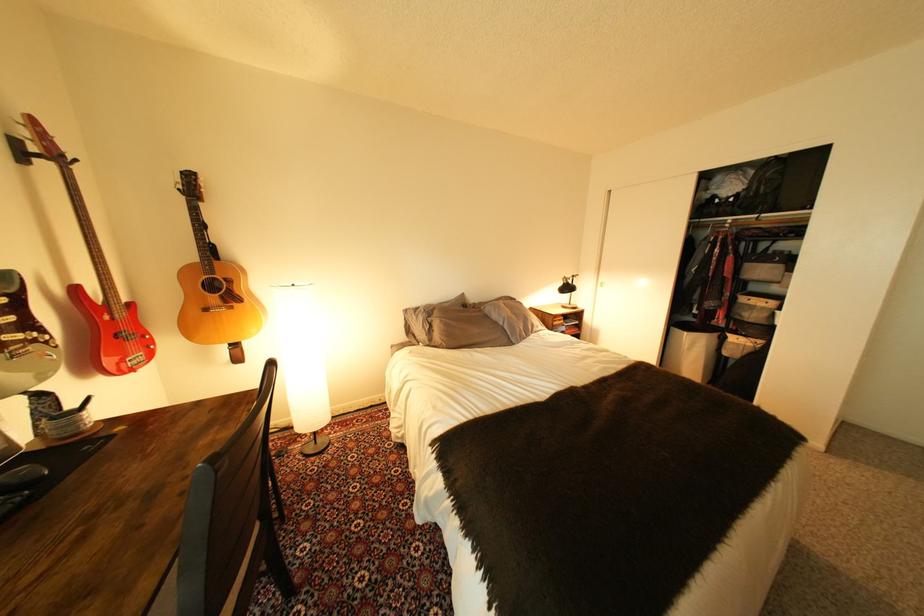
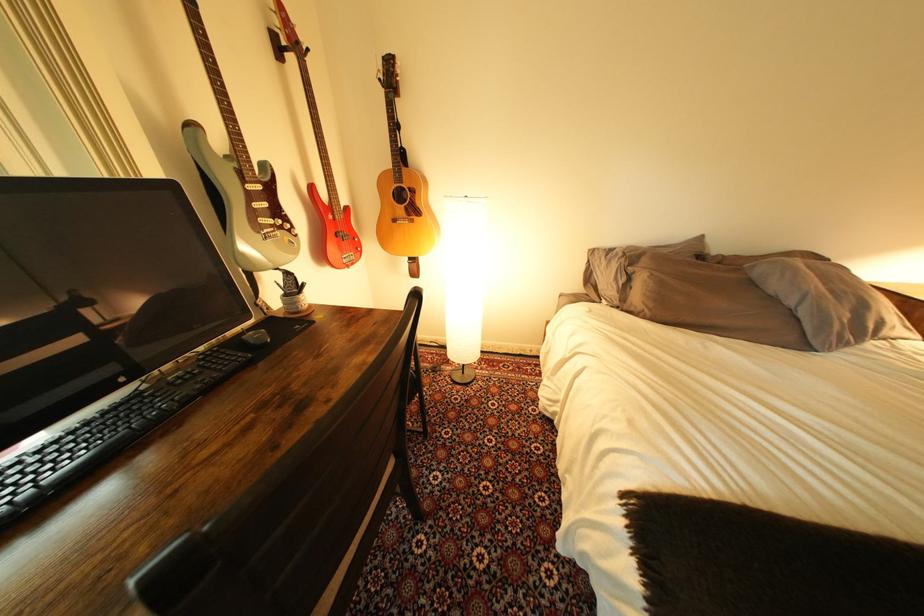
Locate, in the second image, the point that corresponds to pixel 89 424 in the first image.

(309, 304)